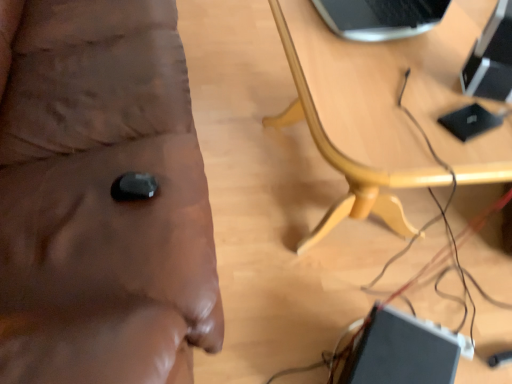
Based on the photo, in order to face black glossy computer at upper right, should I rotate leftwards or rightwards?

To align with it, rotate right about 31.448°.

What do you see at coordinates (490, 58) in the screenshot?
I see `black glossy computer at upper right` at bounding box center [490, 58].

The width and height of the screenshot is (512, 384). In order to click on wooden table at center in this screenshot , I will do `click(384, 112)`.

Is wooden table at center closer to camera compared to black glossy computer at upper right?

Yes, wooden table at center is closer to the camera.

Which of these two, wooden table at center or black glossy computer at upper right, is bigger?

wooden table at center.

Could you tell me if wooden table at center is facing black glossy computer at upper right?

Yes, wooden table at center is aimed at black glossy computer at upper right.

Considering the sizes of wooden table at center and black glossy computer at upper right in the image, is wooden table at center taller or shorter than black glossy computer at upper right?

wooden table at center is taller than black glossy computer at upper right.

What's the angular difference between wooden table at center and wooden table at center's facing directions?

1.08 degrees separate the facing orientations of wooden table at center and wooden table at center.

Between wooden table at center and wooden table at center, which one has larger size?

Bigger between the two is wooden table at center.

Is wooden table at center wider or thinner than wooden table at center?

wooden table at center is wider than wooden table at center.

Are wooden table at center and wooden table at center located far from each other?

No, there isn't a large distance between wooden table at center and wooden table at center.

Could you tell me if black glossy laptop at lower right is facing wooden table at center?

Yes.

Considering the relative sizes of black glossy laptop at lower right and wooden table at center in the image provided, is black glossy laptop at lower right bigger than wooden table at center?

No, black glossy laptop at lower right is not bigger than wooden table at center.

Looking at this image, which of these two, black glossy laptop at lower right or wooden table at center, stands shorter?

Standing shorter between the two is black glossy laptop at lower right.

Is black glossy laptop at lower right situated inside wooden table at center or outside?

black glossy laptop at lower right lies outside wooden table at center.

From the image's perspective, is wooden table at center beneath black glossy computer at upper right?

Yes.

Would you say wooden table at center is to the left or to the right of black glossy computer at upper right in the picture?

From the image, it's evident that wooden table at center is to the left of black glossy computer at upper right.

The width and height of the screenshot is (512, 384). What are the coordinates of `table on the left of the black glossy computer at upper right` in the screenshot? It's located at (384, 112).

Which of these two, wooden table at center or black glossy computer at upper right, is wider?

wooden table at center.

Looking at this image, considering the relative sizes of wooden table at center and black glossy laptop at lower right in the image provided, is wooden table at center shorter than black glossy laptop at lower right?

Incorrect, the height of wooden table at center does not fall short of that of black glossy laptop at lower right.

Is wooden table at center not within black glossy laptop at lower right?

Yes, wooden table at center is outside of black glossy laptop at lower right.

From the image's perspective, is wooden table at center under black glossy laptop at lower right?

Incorrect, from the image's perspective, wooden table at center is higher than black glossy laptop at lower right.

Between wooden table at center and wooden table at center, which one has more height?

Standing taller between the two is wooden table at center.

Does wooden table at center have a lesser width compared to wooden table at center?

Yes.

What's the angular difference between wooden table at center and wooden table at center's facing directions?

The angular difference between wooden table at center and wooden table at center is 1.08 degrees.

Locate an element on the screen. laptop lying below the black glossy computer at upper right (from the image's perspective) is located at coordinates (400, 352).

Looking at this image, which object is positioned more to the left, black glossy laptop at lower right or black glossy computer at upper right?

From the viewer's perspective, black glossy laptop at lower right appears more on the left side.

Who is smaller, black glossy laptop at lower right or black glossy computer at upper right?

black glossy computer at upper right.

The width and height of the screenshot is (512, 384). I want to click on computer above the wooden table at center (from a real-world perspective), so click(490, 58).

The width and height of the screenshot is (512, 384). Identify the location of table below the wooden table at center (from a real-world perspective). pos(384,112).

Considering their positions, is black glossy laptop at lower right positioned closer to wooden table at center than wooden table at center?

black glossy laptop at lower right is closer to wooden table at center.

Which object lies nearer to the anchor point wooden table at center, wooden table at center or black glossy computer at upper right?

wooden table at center.

Estimate the real-world distances between objects in this image. Which object is closer to black glossy computer at upper right, wooden table at center or black glossy laptop at lower right?

Among the two, wooden table at center is located nearer to black glossy computer at upper right.

Based on their spatial positions, is black glossy computer at upper right or wooden table at center further from black glossy laptop at lower right?

The object further to black glossy laptop at lower right is wooden table at center.

From the image, which object appears to be nearer to wooden table at center, wooden table at center or black glossy laptop at lower right?

wooden table at center is closer to wooden table at center.

From the picture: From the image, which object appears to be farther from black glossy computer at upper right, black glossy laptop at lower right or wooden table at center?

black glossy laptop at lower right is positioned further to the anchor black glossy computer at upper right.

Estimate the real-world distances between objects in this image. Which object is closer to wooden table at center, black glossy laptop at lower right or black glossy computer at upper right?

black glossy computer at upper right is positioned closer to the anchor wooden table at center.

When comparing their distances from black glossy computer at upper right, does wooden table at center or wooden table at center seem further?

Among the two, wooden table at center is located further to black glossy computer at upper right.

Identify the location of laptop between wooden table at center and black glossy computer at upper right in the horizontal direction. (400, 352).

At what (x,y) coordinates should I click in order to perform the action: click on table between black glossy computer at upper right and black glossy laptop at lower right in the vertical direction. Please return your answer as a coordinate pair (x, y). The height and width of the screenshot is (384, 512). Looking at the image, I should click on (384, 112).

Identify the location of table situated between wooden table at center and black glossy computer at upper right from left to right. The image size is (512, 384). (384, 112).

The image size is (512, 384). Find the location of `table between wooden table at center and black glossy laptop at lower right from left to right`. table between wooden table at center and black glossy laptop at lower right from left to right is located at coordinates click(384, 112).